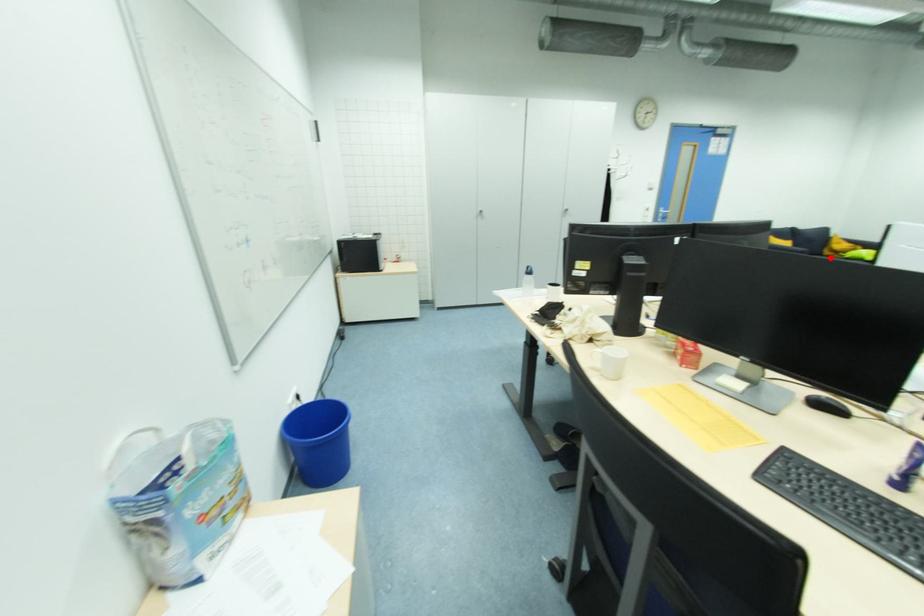
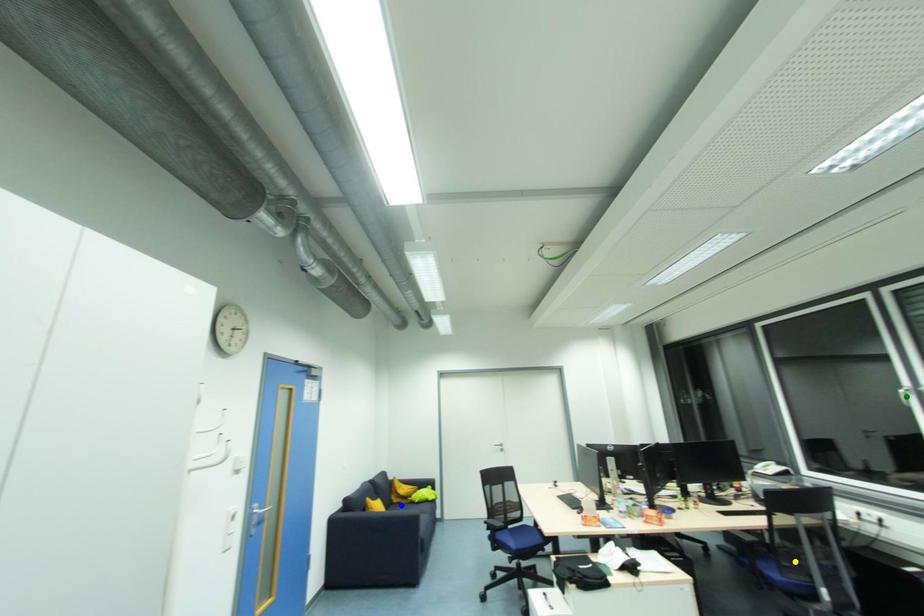
Question: I am providing you with two images of the same scene from different viewpoints. A red point is marked on the first image. You are given multiple points on the second image. Which mark in image 2 goes with the point in image 1?

Choices:
 (A) blue point
 (B) green point
 (C) yellow point

Answer: (A)